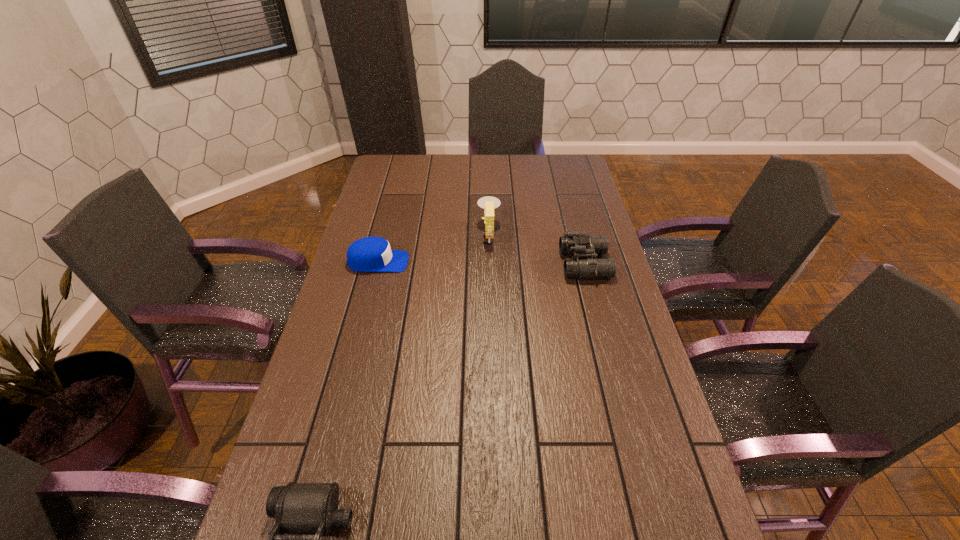
Where is `vacant space that's between the tallest object and the farther binoculars`? This screenshot has width=960, height=540. vacant space that's between the tallest object and the farther binoculars is located at coordinates (537, 249).

The height and width of the screenshot is (540, 960). I want to click on free space between the second tallest object and the sponge, so click(537, 249).

I want to click on vacant area between the baseball cap and the farther binoculars, so click(x=481, y=263).

Locate an element on the screen. The image size is (960, 540). object identified as the third closest to the second tallest object is located at coordinates (299, 508).

Point out which object is positioned as the second nearest to the sponge. Please provide its 2D coordinates. Your answer should be formatted as a tuple, i.e. [(x, y)], where the tuple contains the x and y coordinates of a point satisfying the conditions above.

[(369, 254)]